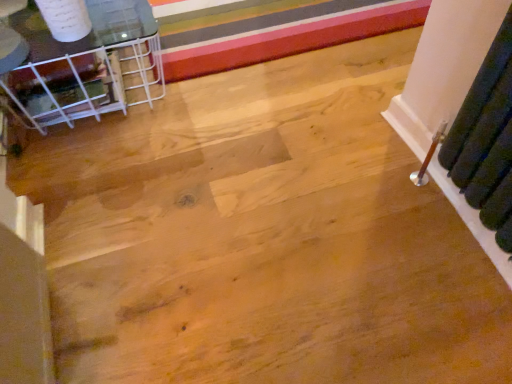
This screenshot has width=512, height=384. I want to click on vacant space to the right of clear glass table at upper left, so click(x=269, y=90).